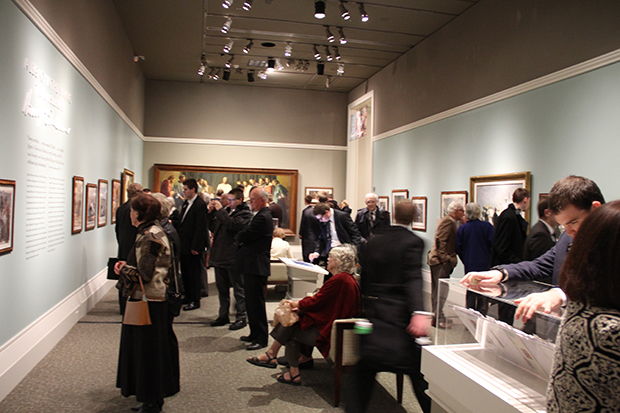
In order to click on down lights in ceiling in this screenshot , I will do `click(363, 18)`, `click(343, 15)`, `click(339, 39)`, `click(219, 29)`, `click(260, 74)`, `click(341, 69)`.